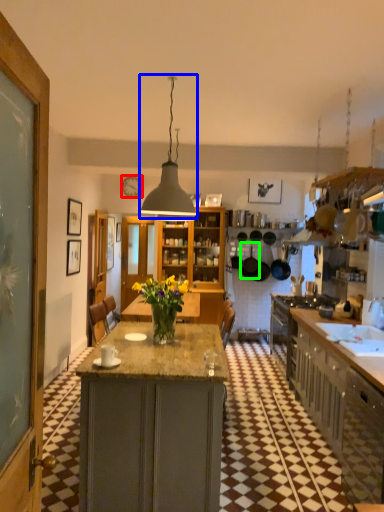
Question: Which is nearer to the clock (highlighted by a red box)? light fixture (highlighted by a blue box) or kitchen appliance (highlighted by a green box).

Choices:
 (A) light fixture
 (B) kitchen appliance

Answer: (B)